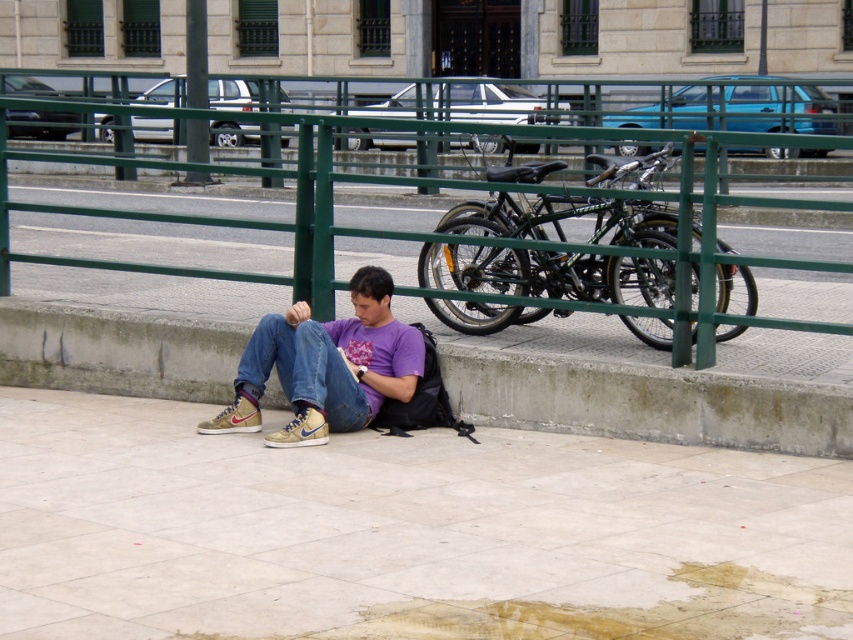
Question: Does smooth concrete pavement at lower center appear under matte purple shirt at center?

Choices:
 (A) no
 (B) yes

Answer: (B)

Question: Which point is farther to the camera?

Choices:
 (A) (459, 308)
 (B) (317, 269)
 (C) (276, 358)

Answer: (A)

Question: Estimate the real-world distances between objects in this image. Which object is farther from the shiny black bicycle at center?

Choices:
 (A) smooth concrete pavement at lower center
 (B) matte purple shirt at center

Answer: (A)

Question: Does concrete at lower left have a larger size compared to shiny black bicycle at center?

Choices:
 (A) no
 (B) yes

Answer: (A)

Question: Is shiny black bicycle at center wider than matte purple shirt at center?

Choices:
 (A) yes
 (B) no

Answer: (A)

Question: Which object is the farthest from the smooth concrete pavement at lower center?

Choices:
 (A) shiny black bicycle at center
 (B) green metal fence at center
 (C) concrete at lower left

Answer: (B)